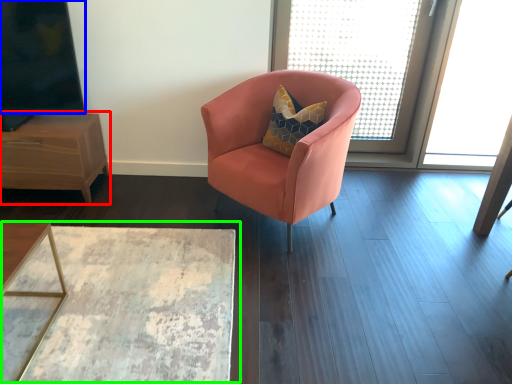
Question: Which object is the closest to the nightstand (highlighted by a red box)? Choose among these: window screen (highlighted by a blue box) or table (highlighted by a green box).

Choices:
 (A) window screen
 (B) table

Answer: (A)